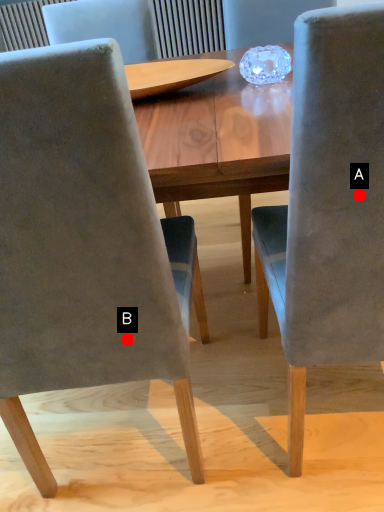
Question: Two points are circled on the image, labeled by A and B beside each circle. Which point is farther to the camera?

Choices:
 (A) A is further
 (B) B is further

Answer: (B)